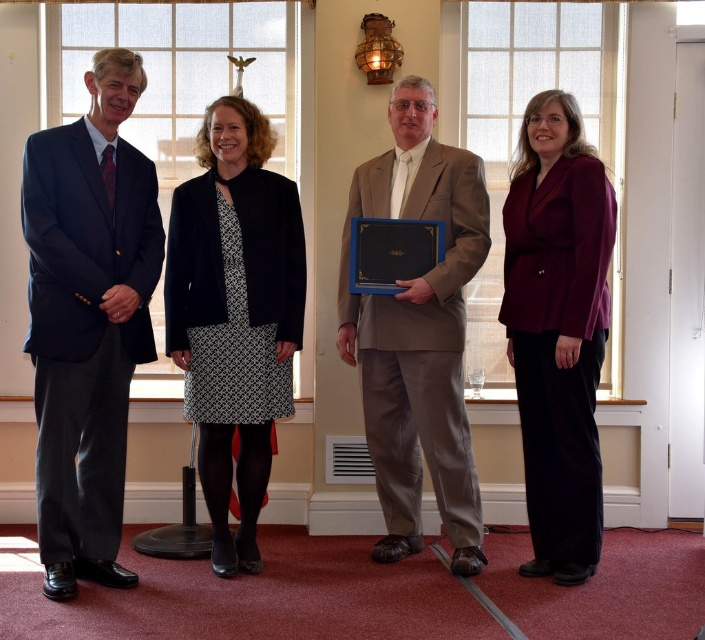
Does matte black suit at left appear on the right side of black textured skirt at center?

Incorrect, matte black suit at left is not on the right side of black textured skirt at center.

Is point (37, 371) positioned in front of point (269, 214)?

Yes, it is in front of point (269, 214).

The height and width of the screenshot is (640, 705). Identify the location of matte black suit at left. (87, 317).

Based on the photo, between black textured skirt at center and burgundy satin blazer at right, which one has less height?

Standing shorter between the two is burgundy satin blazer at right.

Is black textured skirt at center below burgundy satin blazer at right?

No.

Where is `black textured skirt at center`? black textured skirt at center is located at coordinates (233, 312).

Locate an element on the screen. This screenshot has width=705, height=640. black textured skirt at center is located at coordinates (233, 312).

Where is `black textured skirt at center`? This screenshot has width=705, height=640. black textured skirt at center is located at coordinates (233, 312).

Is black textured skirt at center to the right of tan fabric suit at center from the viewer's perspective?

No, black textured skirt at center is not to the right of tan fabric suit at center.

Does point (276, 321) come closer to viewer compared to point (453, 364)?

No, it is not.

Find the location of `black textured skirt at center`. black textured skirt at center is located at coordinates (233, 312).